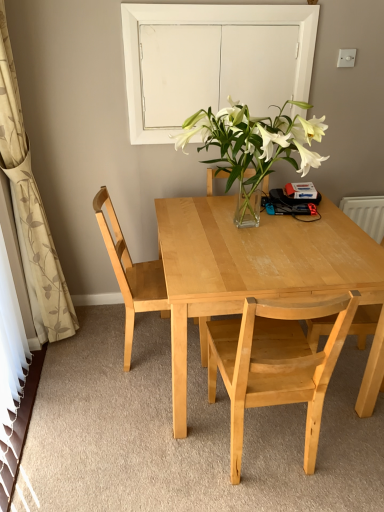
This screenshot has width=384, height=512. In order to click on vacant area in front of beige floral fabric curtain at left in this screenshot , I will do `click(67, 393)`.